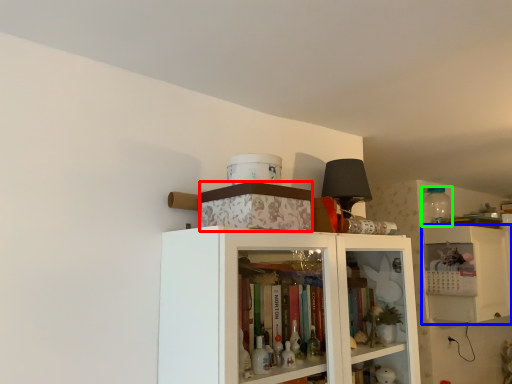
Question: Estimate the real-world distances between objects in this image. Which object is closer to box (highlighted by a red box), cabinetry (highlighted by a blue box) or bottle (highlighted by a green box)?

Choices:
 (A) cabinetry
 (B) bottle

Answer: (A)